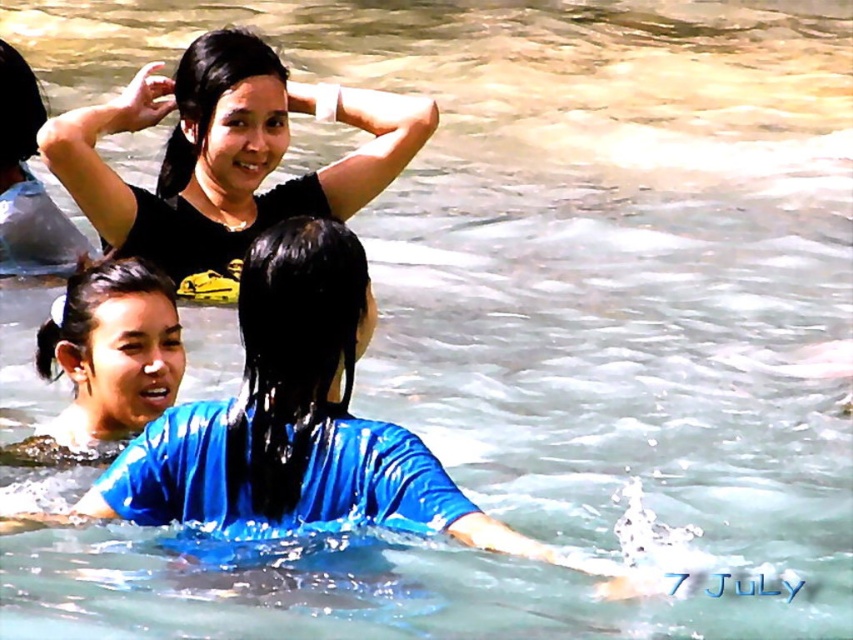
Looking at this image, is blue glossy shirt at center smaller than white glossy hair at center?

No, blue glossy shirt at center is not smaller than white glossy hair at center.

Which is more to the left, blue glossy shirt at center or white glossy hair at center?

Positioned to the left is white glossy hair at center.

Which is behind, point (227, 412) or point (132, 308)?

The point (132, 308) is more distant.

In order to click on blue glossy shirt at center in this screenshot , I will do `click(289, 420)`.

Does black matte shirt at upper center have a greater width compared to white glossy hair at center?

Correct, the width of black matte shirt at upper center exceeds that of white glossy hair at center.

Is black matte shirt at upper center bigger than white glossy hair at center?

Yes, black matte shirt at upper center is bigger than white glossy hair at center.

What do you see at coordinates (225, 157) in the screenshot? The width and height of the screenshot is (853, 640). I see `black matte shirt at upper center` at bounding box center [225, 157].

The height and width of the screenshot is (640, 853). I want to click on black matte shirt at upper center, so click(x=225, y=157).

Is blue glossy shirt at center below black matte shirt at upper center?

Indeed, blue glossy shirt at center is positioned under black matte shirt at upper center.

How far apart are blue glossy shirt at center and black matte shirt at upper center?

blue glossy shirt at center and black matte shirt at upper center are 7.97 meters apart.

The width and height of the screenshot is (853, 640). In order to click on blue glossy shirt at center in this screenshot , I will do `click(289, 420)`.

The height and width of the screenshot is (640, 853). I want to click on blue glossy shirt at center, so click(x=289, y=420).